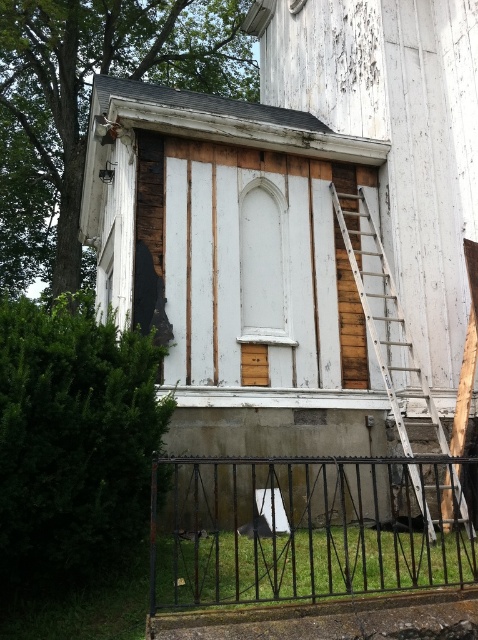
Question: Is black wrought iron fence at lower center smaller than wooden ladder at right?

Choices:
 (A) no
 (B) yes

Answer: (A)

Question: Can you confirm if black wrought iron fence at lower center is smaller than wooden ladder at right?

Choices:
 (A) yes
 (B) no

Answer: (B)

Question: Can you confirm if black wrought iron fence at lower center is positioned to the right of wooden ladder at right?

Choices:
 (A) yes
 (B) no

Answer: (B)

Question: Which of the following is the closest to the observer?

Choices:
 (A) wooden ladder at right
 (B) black wrought iron fence at lower center

Answer: (B)

Question: Among these points, which one is nearest to the camera?

Choices:
 (A) (262, 506)
 (B) (383, 324)

Answer: (A)